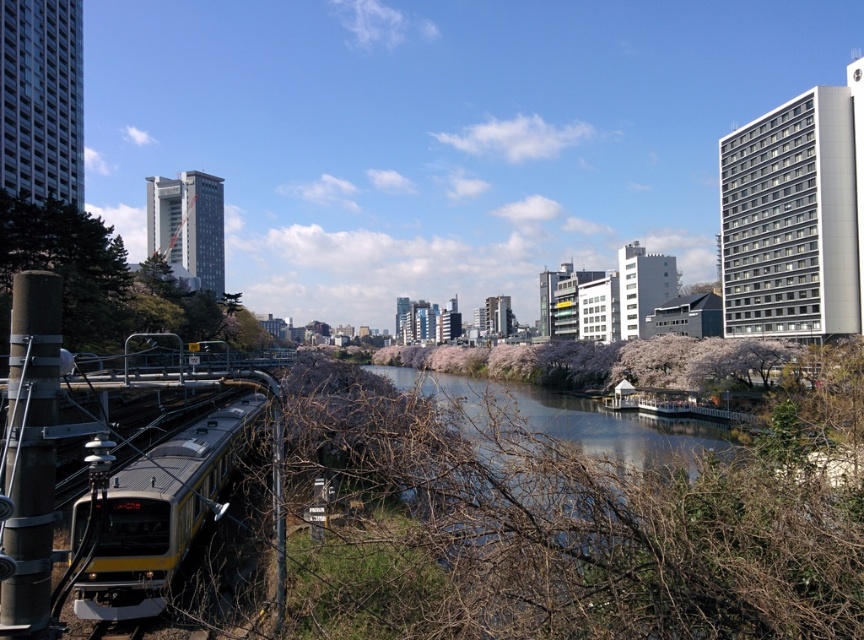
Does yellow metallic train at lower left have a greater height compared to green leafy tree at left?

No.

Who is taller, yellow metallic train at lower left or green leafy tree at left?

Standing taller between the two is green leafy tree at left.

Identify the location of yellow metallic train at lower left. (162, 513).